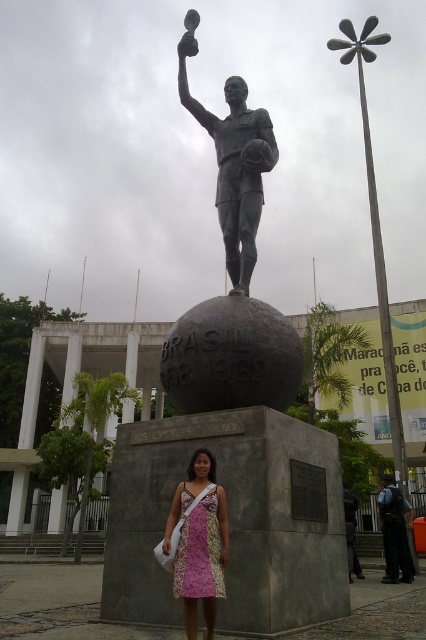
Does point (238, 308) come farther from viewer compared to point (178, 592)?

Yes.

Which is more to the left, polished bronze statue at center or pink floral dress at center?

pink floral dress at center

Is point (244, 88) positioned behind point (181, 548)?

Yes, point (244, 88) is behind point (181, 548).

Find the location of a particular element. The width and height of the screenshot is (426, 640). polished bronze statue at center is located at coordinates (232, 275).

Which is in front, point (250, 275) or point (207, 588)?

Point (207, 588) is more forward.

Can you confirm if bronze statue at center is positioned to the right of pink floral dress at center?

Correct, you'll find bronze statue at center to the right of pink floral dress at center.

The image size is (426, 640). What are the coordinates of `bronze statue at center` in the screenshot? It's located at (235, 164).

Who is lower down, polished bronze statue at center or bronze statue at center?

polished bronze statue at center

Does polished bronze statue at center appear over bronze statue at center?

Actually, polished bronze statue at center is below bronze statue at center.

Who is more distant from viewer, (276, 385) or (193, 36)?

Positioned behind is point (193, 36).

I want to click on polished bronze statue at center, so [232, 275].